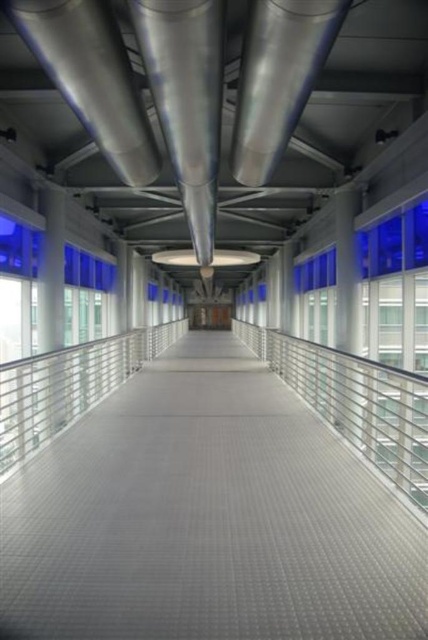
Who is positioned more to the left, silver metallic rail at center or silver metallic pipe at center?

silver metallic pipe at center is more to the left.

This screenshot has width=428, height=640. What do you see at coordinates (356, 404) in the screenshot?
I see `silver metallic rail at center` at bounding box center [356, 404].

What do you see at coordinates (356, 404) in the screenshot? I see `silver metallic rail at center` at bounding box center [356, 404].

Where is `silver metallic rail at center`? silver metallic rail at center is located at coordinates point(356,404).

Can you confirm if gray textured walkway at center is smaller than silver metallic rail at center?

Indeed, gray textured walkway at center has a smaller size compared to silver metallic rail at center.

Is point (418, 604) closer to viewer compared to point (264, 349)?

Yes, it is in front of point (264, 349).

Does point (246, 412) come in front of point (392, 474)?

Yes, point (246, 412) is in front of point (392, 474).

Locate an element on the screen. gray textured walkway at center is located at coordinates (x=207, y=516).

Does silver metallic pipe at center appear on the left side of silver metallic pipe at upper center?

Correct, you'll find silver metallic pipe at center to the left of silver metallic pipe at upper center.

Is silver metallic pipe at center positioned in front of silver metallic pipe at upper center?

Yes, it is.

This screenshot has height=640, width=428. What are the coordinates of `silver metallic pipe at center` in the screenshot? It's located at (187, 99).

The width and height of the screenshot is (428, 640). I want to click on silver metallic pipe at center, so click(187, 99).